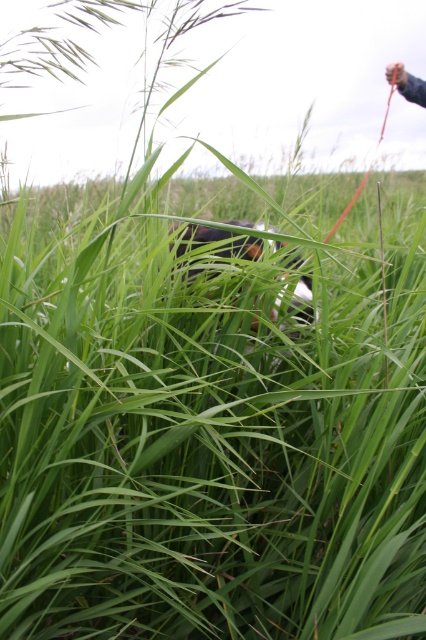
From the picture: Can you confirm if green grassy field at center is shorter than smooth skin hand at upper right?

In fact, green grassy field at center may be taller than smooth skin hand at upper right.

Identify the location of green grassy field at center. This screenshot has width=426, height=640. (209, 429).

Can you confirm if black fur dog at center is thinner than smooth skin hand at upper right?

No.

Is black fur dog at center positioned in front of smooth skin hand at upper right?

Yes, it is.

This screenshot has height=640, width=426. What do you see at coordinates (221, 240) in the screenshot?
I see `black fur dog at center` at bounding box center [221, 240].

What are the coordinates of `black fur dog at center` in the screenshot? It's located at (221, 240).

Between green grassy field at center and black fur dog at center, which one has more height?

green grassy field at center is taller.

Does point (161, 262) come farther from viewer compared to point (310, 317)?

No, (161, 262) is in front of (310, 317).

Does point (302, 417) come farther from viewer compared to point (198, 268)?

No, (302, 417) is closer to viewer.

You are a GUI agent. You are given a task and a screenshot of the screen. Output one action in this format:
    pyautogui.click(x=<x>, y=<y>)
    Task: Click on the green grassy field at center
    This screenshot has width=426, height=640.
    Given the screenshot: What is the action you would take?
    pyautogui.click(x=209, y=429)